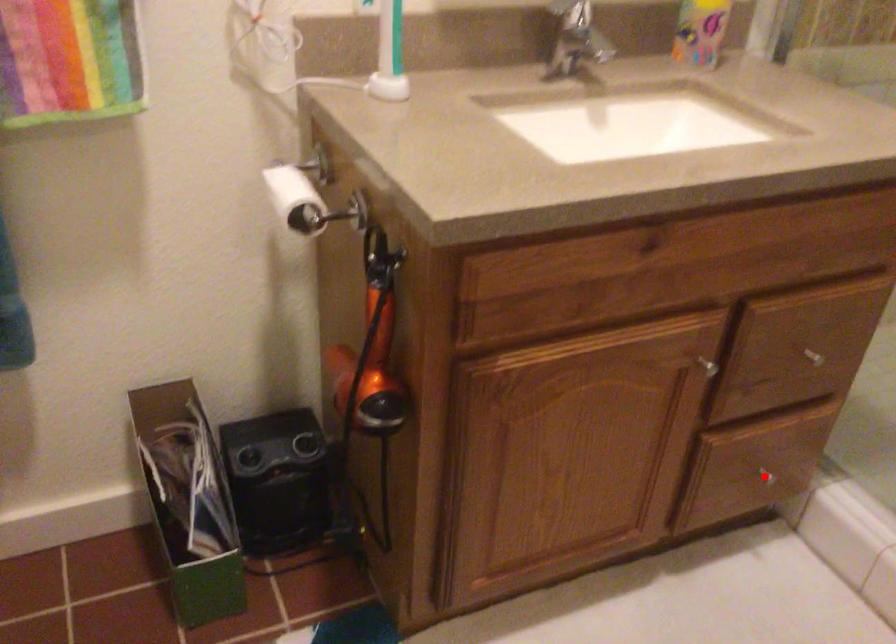
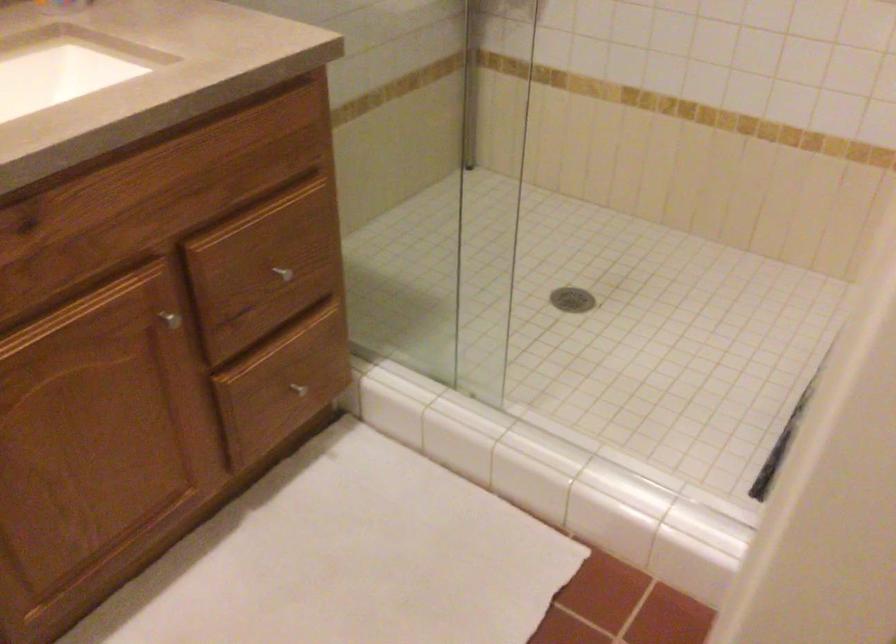
Where in the second image is the point corresponding to the highlighted location from the first image?

(297, 389)